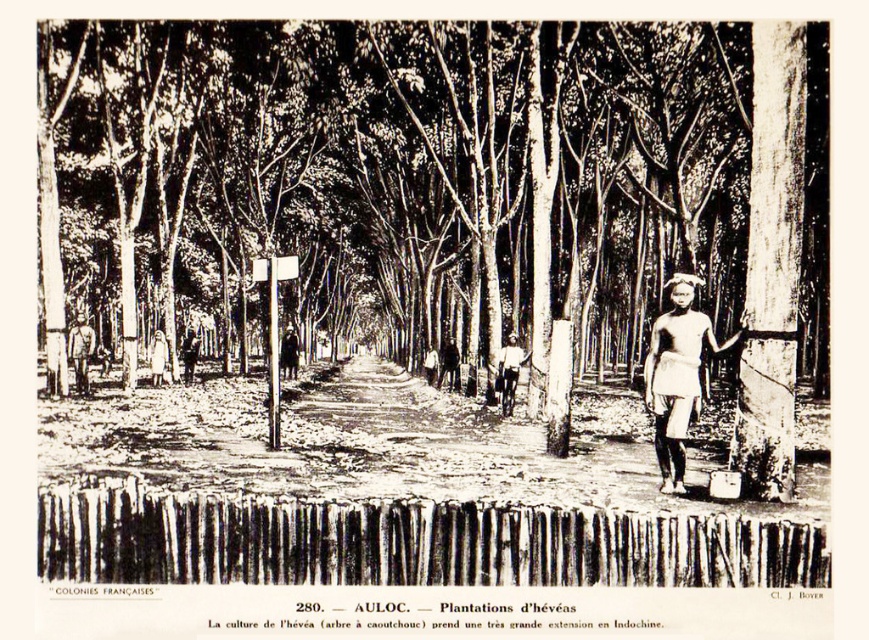
Question: Which object is positioned closest to the dark skin/white cloth skirt at center?

Choices:
 (A) white cotton shirt at center
 (B) light brown wooden post at left

Answer: (A)

Question: Can you confirm if smooth bark tree at center is thinner than white cotton shirt at center?

Choices:
 (A) yes
 (B) no

Answer: (B)

Question: Does smooth bark tree at center have a lesser width compared to dark skin/white cloth skirt at center?

Choices:
 (A) no
 (B) yes

Answer: (A)

Question: Which point is closer to the camera?

Choices:
 (A) smooth bark tree at center
 (B) white cotton shirt at center

Answer: (A)

Question: From the image, what is the correct spatial relationship of smooth bark tree at center in relation to light brown wooden post at left?

Choices:
 (A) right
 (B) left

Answer: (A)

Question: Which of the following is the closest to the observer?

Choices:
 (A) (707, 337)
 (B) (506, 344)

Answer: (A)